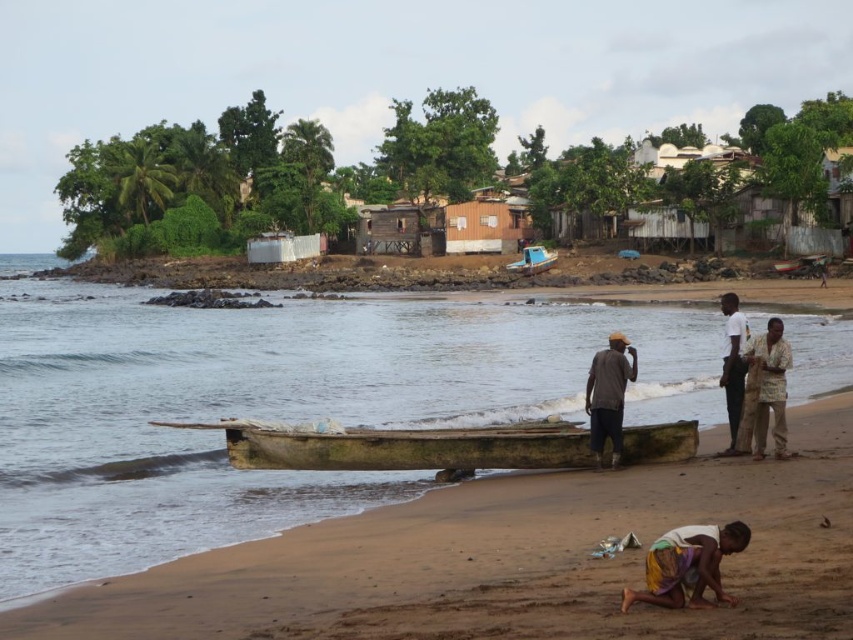
The image size is (853, 640). What do you see at coordinates (608, 394) in the screenshot? I see `brown matte shirt at center` at bounding box center [608, 394].

Based on the photo, does brown matte shirt at center have a greater width compared to white matte shirt at right?

Incorrect, brown matte shirt at center's width does not surpass white matte shirt at right's.

Where is `brown matte shirt at center`? This screenshot has height=640, width=853. brown matte shirt at center is located at coordinates (608, 394).

I want to click on brown matte shirt at center, so click(608, 394).

Between wooden boat at center and blue plastic boat at center, which one has less height?

With less height is wooden boat at center.

Can you confirm if wooden boat at center is bigger than blue plastic boat at center?

Yes.

Is point (329, 452) more distant than point (524, 256)?

That is False.

The width and height of the screenshot is (853, 640). Find the location of `wooden boat at center`. wooden boat at center is located at coordinates (404, 448).

Based on the photo, is wooden boat at center bigger than white matte shirt at right?

No, wooden boat at center is not bigger than white matte shirt at right.

Between point (630, 429) and point (737, 310), which one is positioned behind?

Positioned behind is point (737, 310).

Is point (456, 465) farther from viewer compared to point (724, 304)?

No, (456, 465) is closer to viewer.

Find the location of a particular element. The width and height of the screenshot is (853, 640). wooden boat at center is located at coordinates (404, 448).